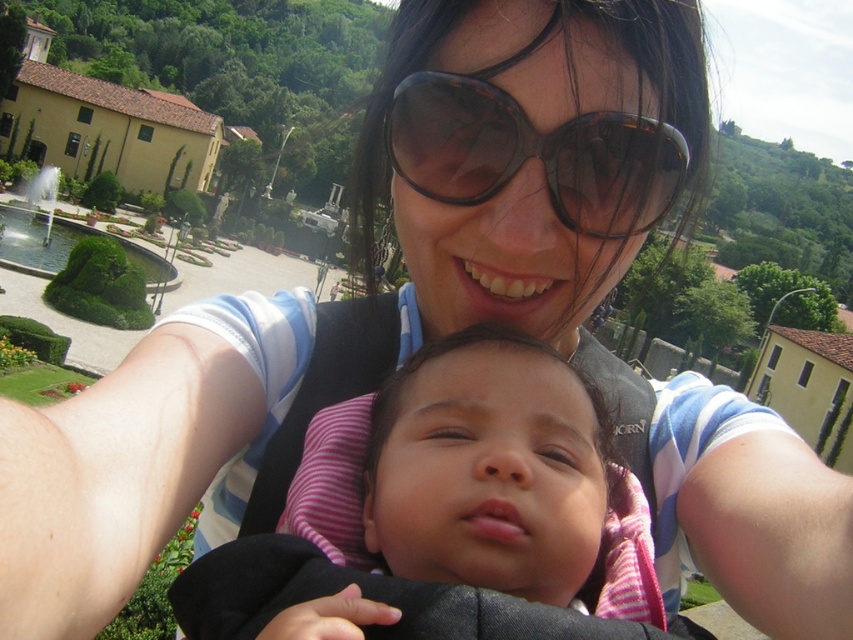
Question: Which point appears closest to the camera in this image?

Choices:
 (A) (572, 504)
 (B) (561, 212)

Answer: (A)

Question: Is the position of pink striped fabric at center less distant than that of tortoiseshell plastic goggles at center?

Choices:
 (A) yes
 (B) no

Answer: (A)

Question: Considering the relative positions of pink striped fabric at center and tortoiseshell plastic goggles at center in the image provided, where is pink striped fabric at center located with respect to tortoiseshell plastic goggles at center?

Choices:
 (A) below
 (B) above

Answer: (A)

Question: Can you confirm if pink striped fabric at center is positioned below tortoiseshell plastic goggles at center?

Choices:
 (A) no
 (B) yes

Answer: (B)

Question: Among these objects, which one is nearest to the camera?

Choices:
 (A) tortoiseshell plastic goggles at center
 (B) pink striped fabric at center

Answer: (B)